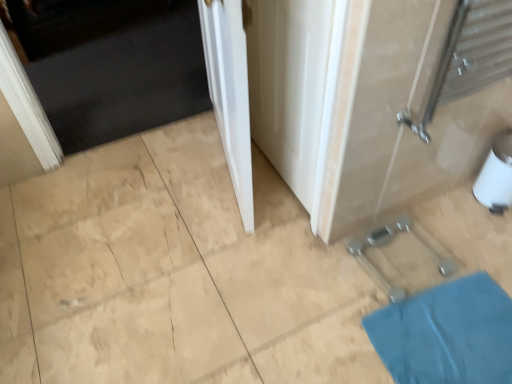
What is the approximate height of white glossy door at upper left, the first door viewed from the back?

white glossy door at upper left, the first door viewed from the back, is 1.03 inches tall.

You are a GUI agent. You are given a task and a screenshot of the screen. Output one action in this format:
    pyautogui.click(x=<x>, y=<y>)
    Task: Click on the blue fabric bath mat at lower right
    This screenshot has height=384, width=512.
    Given the screenshot: What is the action you would take?
    pyautogui.click(x=447, y=334)

Could white smooth door at center, the 2th door in the back-to-front sequence, be considered to be inside white glossy door at upper left, which is counted as the first door, starting from the left?

Actually, white smooth door at center, the 2th door in the back-to-front sequence, is outside white glossy door at upper left, which is counted as the first door, starting from the left.

Are white glossy door at upper left, the first door viewed from the back, and white smooth door at center, which ranks as the 2th door in left-to-right order, far apart?

white glossy door at upper left, the first door viewed from the back, is positioned a significant distance from white smooth door at center, which ranks as the 2th door in left-to-right order.

From a real-world perspective, is white glossy door at upper left, acting as the second door starting from the front, above or below white smooth door at center, the 1th door positioned from the front?

white glossy door at upper left, acting as the second door starting from the front, is below white smooth door at center, the 1th door positioned from the front.

Is white glossy door at upper left, which is counted as the first door, starting from the left, oriented towards white smooth door at center, the 2th door in the back-to-front sequence?

No, white glossy door at upper left, which is counted as the first door, starting from the left, is not aimed at white smooth door at center, the 2th door in the back-to-front sequence.

Locate an element on the screen. This screenshot has width=512, height=384. the 1st door counting from the left side of the blue fabric bath mat at lower right is located at coordinates (230, 93).

Is white smooth door at center, which ranks as the 2th door in left-to-right order, outside of blue fabric bath mat at lower right?

Yes.

Between white smooth door at center, acting as the first door starting from the right, and blue fabric bath mat at lower right, which one has larger width?

With larger width is blue fabric bath mat at lower right.

Which object is wider, blue fabric bath mat at lower right or white glossy door at center?

Wider between the two is blue fabric bath mat at lower right.

In terms of height, does blue fabric bath mat at lower right look taller or shorter compared to white glossy door at center?

Considering their sizes, blue fabric bath mat at lower right has less height than white glossy door at center.

Considering the relative sizes of blue fabric bath mat at lower right and white glossy door at center in the image provided, is blue fabric bath mat at lower right smaller than white glossy door at center?

Yes.

Based on their sizes in the image, would you say white glossy door at upper left, the first door viewed from the back, is bigger or smaller than white glossy door at center?

In the image, white glossy door at upper left, the first door viewed from the back, appears to be larger than white glossy door at center.

This screenshot has height=384, width=512. In order to click on door directly beneath the white glossy door at center (from a real-world perspective) in this screenshot , I will do `click(113, 65)`.

Is white glossy door at upper left, which is counted as the first door, starting from the left, situated inside blue fabric bath mat at lower right or outside?

white glossy door at upper left, which is counted as the first door, starting from the left, cannot be found inside blue fabric bath mat at lower right.

Which object is further away from the camera, white glossy door at upper left, acting as the second door starting from the front, or blue fabric bath mat at lower right?

white glossy door at upper left, acting as the second door starting from the front, is further away from the camera.

Which is closer to the camera, [145,120] or [426,354]?

Point [145,120] is farther from the camera than point [426,354].

Which of these two, blue fabric bath mat at lower right or white smooth door at center, the 2th door in the back-to-front sequence, is bigger?

white smooth door at center, the 2th door in the back-to-front sequence.

Does point (389, 352) appear closer or farther from the camera than point (243, 193)?

Point (389, 352) is positioned closer to the camera compared to point (243, 193).

From the image's perspective, is blue fabric bath mat at lower right on white smooth door at center, acting as the first door starting from the right?

Actually, blue fabric bath mat at lower right appears below white smooth door at center, acting as the first door starting from the right, in the image.

Identify the location of bath mat behind the white smooth door at center, which ranks as the 2th door in left-to-right order. The image size is (512, 384). (447, 334).

Considering the relative sizes of blue fabric bath mat at lower right and white glossy door at upper left, which ranks as the second door in right-to-left order, in the image provided, is blue fabric bath mat at lower right shorter than white glossy door at upper left, which ranks as the second door in right-to-left order,?

Indeed, blue fabric bath mat at lower right has a lesser height compared to white glossy door at upper left, which ranks as the second door in right-to-left order.

In terms of size, does blue fabric bath mat at lower right appear bigger or smaller than white glossy door at upper left, which is counted as the first door, starting from the left?

blue fabric bath mat at lower right is smaller than white glossy door at upper left, which is counted as the first door, starting from the left.

Where is `bath mat positioned vertically above the white glossy door at upper left, the first door viewed from the back (from a real-world perspective)`? bath mat positioned vertically above the white glossy door at upper left, the first door viewed from the back (from a real-world perspective) is located at coordinates (447, 334).

Locate an element on the screen. This screenshot has height=384, width=512. door below the white smooth door at center, which ranks as the 2th door in left-to-right order (from a real-world perspective) is located at coordinates (113, 65).

You are a GUI agent. You are given a task and a screenshot of the screen. Output one action in this format:
    pyautogui.click(x=<x>, y=<y>)
    Task: Click on the bath mat on the right of white smooth door at center, the 1th door positioned from the front
    The width and height of the screenshot is (512, 384).
    Given the screenshot: What is the action you would take?
    pyautogui.click(x=447, y=334)

When comparing their distances from white glossy door at center, does white smooth door at center, the 1th door positioned from the front, or blue fabric bath mat at lower right seem further?

Among the two, blue fabric bath mat at lower right is located further to white glossy door at center.

Which object lies further to the anchor point white glossy door at upper left, the first door viewed from the back, white smooth door at center, the 2th door in the back-to-front sequence, or blue fabric bath mat at lower right?

blue fabric bath mat at lower right.

Considering their positions, is blue fabric bath mat at lower right positioned further to white glossy door at center than white smooth door at center, the 1th door positioned from the front?

blue fabric bath mat at lower right lies further to white glossy door at center than the other object.

Based on their spatial positions, is white glossy door at upper left, which ranks as the second door in right-to-left order, or white glossy door at center closer to blue fabric bath mat at lower right?

white glossy door at center is closer to blue fabric bath mat at lower right.

From the image, which object appears to be nearer to white glossy door at upper left, the first door viewed from the back, white glossy door at center or blue fabric bath mat at lower right?

The object closer to white glossy door at upper left, the first door viewed from the back, is white glossy door at center.

From the image, which object appears to be nearer to white glossy door at upper left, the first door viewed from the back, white smooth door at center, the 2th door in the back-to-front sequence, or white glossy door at center?

white smooth door at center, the 2th door in the back-to-front sequence, lies closer to white glossy door at upper left, the first door viewed from the back, than the other object.

When comparing their distances from white glossy door at center, does white glossy door at upper left, acting as the second door starting from the front, or white smooth door at center, acting as the first door starting from the right, seem closer?

white smooth door at center, acting as the first door starting from the right.

From the image, which object appears to be nearer to white smooth door at center, which ranks as the 2th door in left-to-right order, white glossy door at center or white glossy door at upper left, which ranks as the second door in right-to-left order?

white glossy door at center is closer to white smooth door at center, which ranks as the 2th door in left-to-right order.

The image size is (512, 384). What are the coordinates of `door situated between white glossy door at upper left, the first door viewed from the back, and blue fabric bath mat at lower right from left to right` in the screenshot? It's located at (230, 93).

You are a GUI agent. You are given a task and a screenshot of the screen. Output one action in this format:
    pyautogui.click(x=<x>, y=<y>)
    Task: Click on the screen door between white smooth door at center, the 1th door positioned from the front, and blue fabric bath mat at lower right from top to bottom
    This screenshot has height=384, width=512.
    Given the screenshot: What is the action you would take?
    pyautogui.click(x=294, y=86)

The height and width of the screenshot is (384, 512). In order to click on screen door between white glossy door at upper left, which ranks as the second door in right-to-left order, and blue fabric bath mat at lower right in this screenshot , I will do click(294, 86).

This screenshot has height=384, width=512. I want to click on screen door located between white smooth door at center, which ranks as the 2th door in left-to-right order, and white glossy door at upper left, acting as the second door starting from the front, in the depth direction, so click(294, 86).